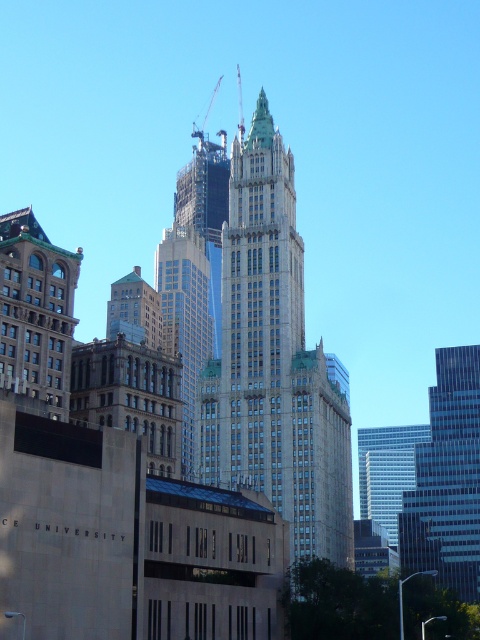
Question: Is brown brick building at center-left wider than metallic gray crane at upper center?

Choices:
 (A) no
 (B) yes

Answer: (B)

Question: In this image, where is silver glass skyscraper at center located relative to brown stone building at center-left?

Choices:
 (A) right
 (B) left

Answer: (A)

Question: Is beige stone tower at center positioned behind brown stone building at center-left?

Choices:
 (A) yes
 (B) no

Answer: (B)

Question: Which object appears closest to the camera in this image?

Choices:
 (A) green stone tower at left
 (B) beige stone tower at center

Answer: (A)

Question: Which point is farther to the camera?

Choices:
 (A) brown brick building at center-left
 (B) glassy steel skyscraper at center
 (C) metallic gray crane at upper center

Answer: (C)

Question: Which is farther from the green stone tower at left?

Choices:
 (A) metallic gray crane at upper center
 (B) brown stone building at center-left
 (C) glassy steel skyscraper at center

Answer: (A)